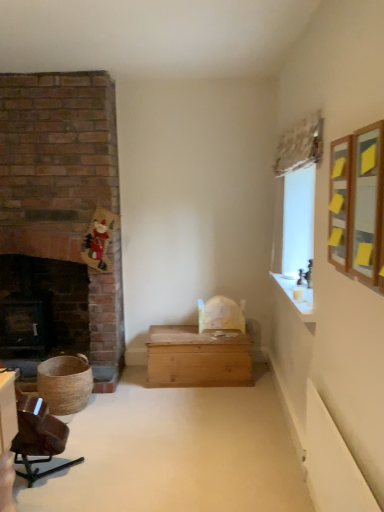
Question: Is wooden chest at center surrounding white glossy mantle at upper right?

Choices:
 (A) yes
 (B) no

Answer: (B)

Question: From the image's perspective, does wooden chest at center appear lower than white glossy mantle at upper right?

Choices:
 (A) yes
 (B) no

Answer: (A)

Question: Considering the relative sizes of wooden chest at center and white glossy mantle at upper right in the image provided, is wooden chest at center wider than white glossy mantle at upper right?

Choices:
 (A) no
 (B) yes

Answer: (B)

Question: Would you say wooden chest at center is outside white glossy mantle at upper right?

Choices:
 (A) yes
 (B) no

Answer: (A)

Question: Is wooden chest at center further to camera compared to white glossy mantle at upper right?

Choices:
 (A) yes
 (B) no

Answer: (A)

Question: Considering the positions of wooden chest at center and wooden framed mirror at upper right in the image, is wooden chest at center bigger or smaller than wooden framed mirror at upper right?

Choices:
 (A) big
 (B) small

Answer: (A)

Question: Is point (236, 343) closer or farther from the camera than point (359, 260)?

Choices:
 (A) closer
 (B) farther

Answer: (B)

Question: In the image, is wooden chest at center positioned in front of or behind wooden framed mirror at upper right?

Choices:
 (A) front
 (B) behind

Answer: (B)

Question: Considering the positions of wooden chest at center and wooden framed mirror at upper right in the image, is wooden chest at center wider or thinner than wooden framed mirror at upper right?

Choices:
 (A) wide
 (B) thin

Answer: (A)

Question: Does point (59, 330) appear closer or farther from the camera than point (170, 328)?

Choices:
 (A) farther
 (B) closer

Answer: (A)

Question: Considering their positions, is black cast iron fireplace at left located in front of or behind wooden chest at center?

Choices:
 (A) behind
 (B) front

Answer: (A)

Question: Visually, is black cast iron fireplace at left positioned to the left or to the right of wooden chest at center?

Choices:
 (A) left
 (B) right

Answer: (A)

Question: Choose the correct answer: Is black cast iron fireplace at left inside wooden chest at center or outside it?

Choices:
 (A) inside
 (B) outside

Answer: (B)

Question: From their relative heights in the image, would you say white glossy mantle at upper right is taller or shorter than wooden chest at center?

Choices:
 (A) tall
 (B) short

Answer: (B)

Question: Which is correct: white glossy mantle at upper right is inside wooden chest at center, or outside of it?

Choices:
 (A) outside
 (B) inside

Answer: (A)